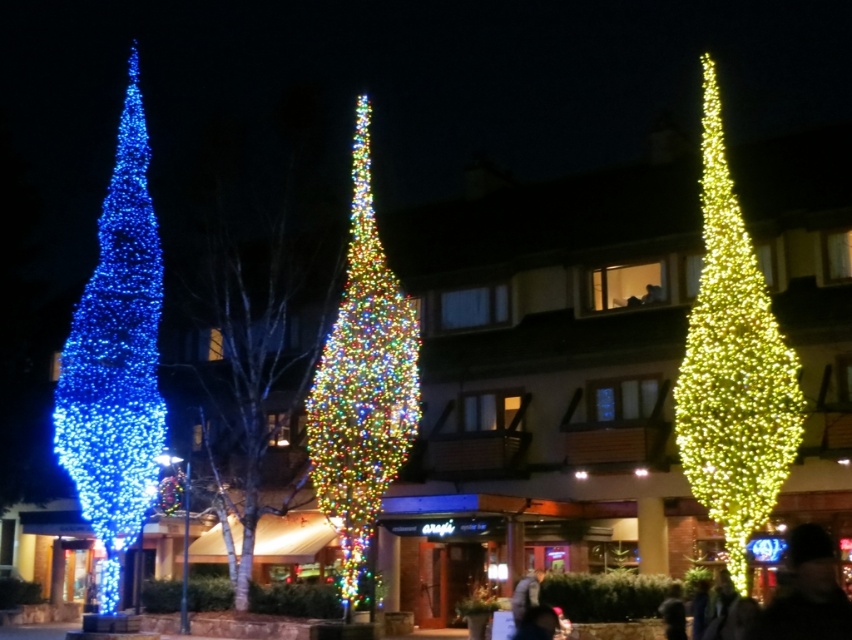
You are standing at the center of the scene and want to approach the blue glossy christmas tree at left. Which direction should you move to reach it?

Since the blue glossy christmas tree at left is located at point (x=116, y=360), you should move to the left from your current position at the center to reach it.

You are standing in front of the building and want to take a photo of the multicolored lights at center without the blue glossy christmas tree at left blocking the view. Is this possible?

The multicolored lights at center is behind the blue glossy christmas tree at left, so taking a photo of the multicolored lights at center without the blue glossy christmas tree at left blocking the view is not possible.

You are standing in front of the building and notice the blue glossy christmas tree at left and the shiny gold christmas tree at right. Which tree is positioned lower in the scene?

The blue glossy christmas tree at left is located below the shiny gold christmas tree at right, so it is positioned lower in the scene.